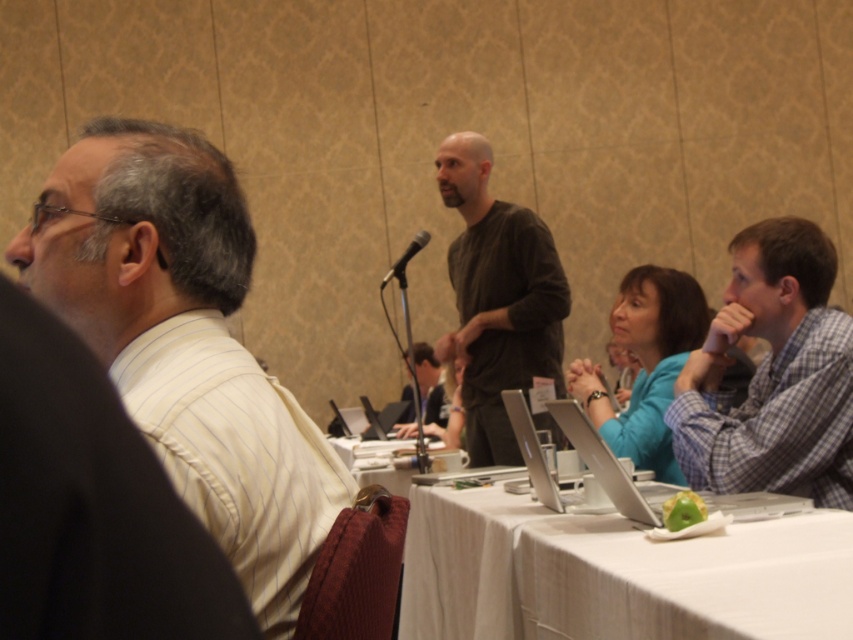
Who is higher up, white striped shirt at left or blue plaid shirt at right?

blue plaid shirt at right is above.

Does white striped shirt at left have a lesser width compared to blue plaid shirt at right?

Correct, white striped shirt at left's width is less than blue plaid shirt at right's.

Locate an element on the screen. This screenshot has height=640, width=853. white striped shirt at left is located at coordinates (184, 342).

Find the location of a particular element. white striped shirt at left is located at coordinates (184, 342).

Which is above, blue plaid shirt at right or dark brown cotton shirt at center?

dark brown cotton shirt at center

Which is more to the left, blue plaid shirt at right or dark brown cotton shirt at center?

Positioned to the left is dark brown cotton shirt at center.

Where is `blue plaid shirt at right`? blue plaid shirt at right is located at coordinates (772, 374).

Between white cloth table at lower center and blue plaid shirt at right, which one appears on the right side from the viewer's perspective?

Positioned to the right is blue plaid shirt at right.

Does point (561, 582) come closer to viewer compared to point (699, 349)?

Yes, point (561, 582) is closer to viewer.

Find the location of a particular element. This screenshot has width=853, height=640. white cloth table at lower center is located at coordinates (614, 573).